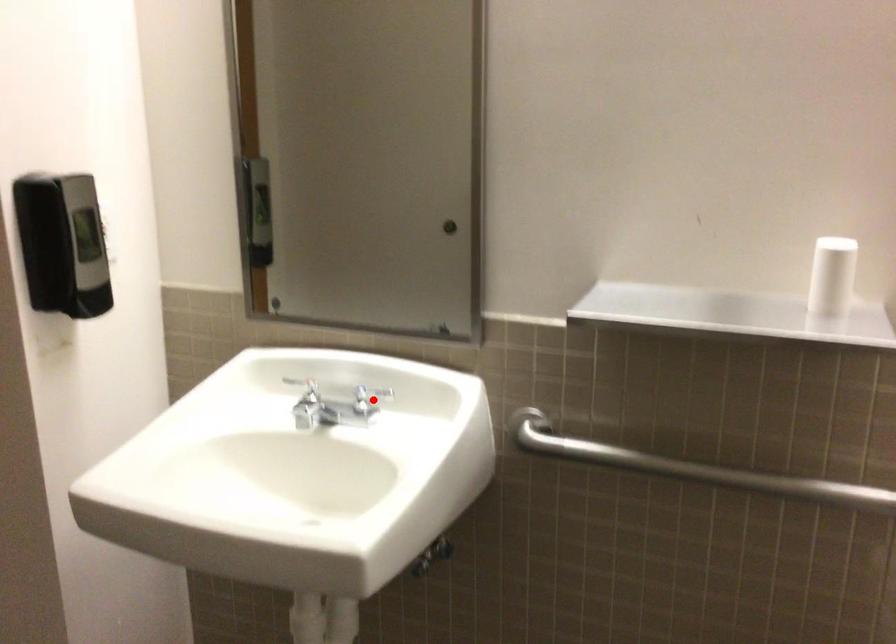
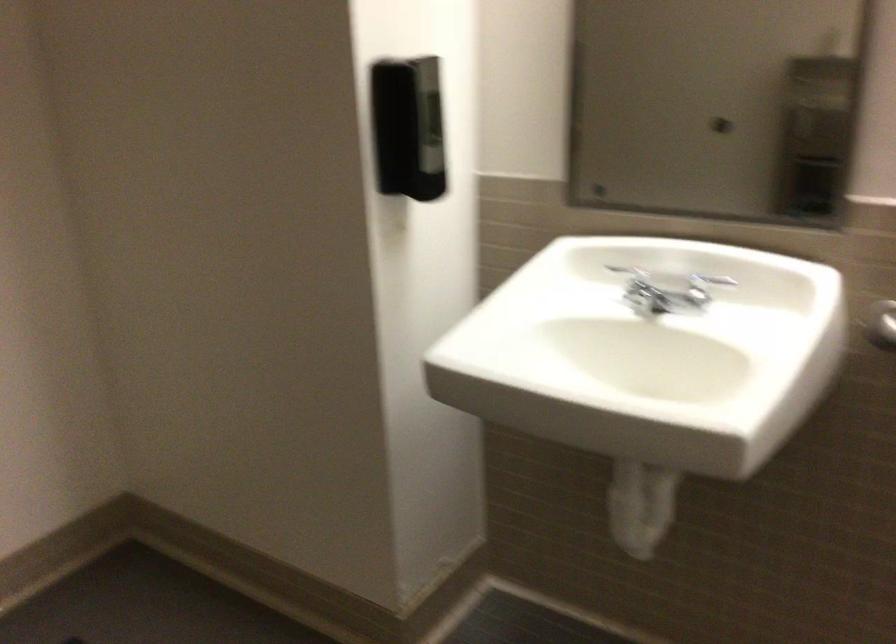
Question: I am providing you with two images of the same scene from different viewpoints. A red point is marked on the first image. At the location where the point appears in image 1, is it still visible in image 2?

Choices:
 (A) Yes
 (B) No

Answer: (A)